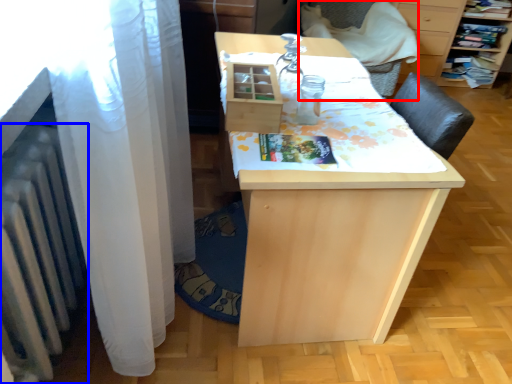
Question: Among these objects, which one is farthest to the camera, armchair (highlighted by a red box) or radiator (highlighted by a blue box)?

Choices:
 (A) armchair
 (B) radiator

Answer: (A)